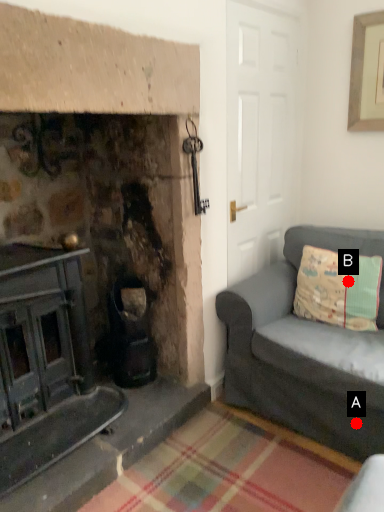
Question: Two points are circled on the image, labeled by A and B beside each circle. Which point appears farthest from the camera in this image?

Choices:
 (A) A is further
 (B) B is further

Answer: (B)